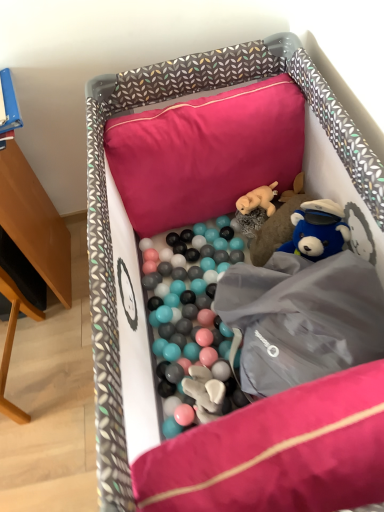
Question: Is fuzzy beige dog at center, acting as the second toy starting from the bottom, closer to the viewer compared to pink fabric pillow at upper center?

Choices:
 (A) no
 (B) yes

Answer: (A)

Question: Considering the relative positions of fuzzy beige dog at center, acting as the second toy starting from the bottom, and pink fabric pillow at upper center in the image provided, is fuzzy beige dog at center, acting as the second toy starting from the bottom, behind pink fabric pillow at upper center?

Choices:
 (A) no
 (B) yes

Answer: (B)

Question: Is fuzzy beige dog at center, acting as the second toy starting from the bottom, turned away from pink fabric pillow at upper center?

Choices:
 (A) no
 (B) yes

Answer: (A)

Question: Does fuzzy beige dog at center, which is counted as the 1th toy, starting from the top, have a greater height compared to pink fabric pillow at upper center?

Choices:
 (A) no
 (B) yes

Answer: (A)

Question: Does fuzzy beige dog at center, which is counted as the 1th toy, starting from the top, appear on the right side of pink fabric pillow at upper center?

Choices:
 (A) no
 (B) yes

Answer: (B)

Question: In the image, is fluffy plush bear at center, acting as the 1th toy starting from the bottom, positioned in front of or behind fuzzy beige dog at center, which is counted as the 1th toy, starting from the top?

Choices:
 (A) behind
 (B) front

Answer: (B)

Question: Is point (297, 202) positioned closer to the camera than point (248, 212)?

Choices:
 (A) farther
 (B) closer

Answer: (B)

Question: Do you think fluffy plush bear at center, which appears as the second toy when viewed from the top, is within fuzzy beige dog at center, acting as the second toy starting from the bottom, or outside of it?

Choices:
 (A) inside
 (B) outside

Answer: (B)

Question: From a real-world perspective, is fluffy plush bear at center, acting as the 1th toy starting from the bottom, physically located above or below fuzzy beige dog at center, acting as the second toy starting from the bottom?

Choices:
 (A) above
 (B) below

Answer: (B)

Question: In terms of height, does fuzzy beige dog at center, which is counted as the 1th toy, starting from the top, look taller or shorter compared to soft fabric playpen at center?

Choices:
 (A) short
 (B) tall

Answer: (A)

Question: From the image's perspective, is fuzzy beige dog at center, which is counted as the 1th toy, starting from the top, above or below soft fabric playpen at center?

Choices:
 (A) below
 (B) above

Answer: (B)

Question: Considering their positions, is fuzzy beige dog at center, which is counted as the 1th toy, starting from the top, located in front of or behind soft fabric playpen at center?

Choices:
 (A) behind
 (B) front

Answer: (A)

Question: Considering the positions of fuzzy beige dog at center, which is counted as the 1th toy, starting from the top, and soft fabric playpen at center in the image, is fuzzy beige dog at center, which is counted as the 1th toy, starting from the top, wider or thinner than soft fabric playpen at center?

Choices:
 (A) wide
 (B) thin

Answer: (B)

Question: Is fluffy plush bear at center, acting as the 1th toy starting from the bottom, spatially inside soft fabric playpen at center, or outside of it?

Choices:
 (A) outside
 (B) inside

Answer: (B)

Question: Considering the positions of fluffy plush bear at center, which appears as the second toy when viewed from the top, and soft fabric playpen at center in the image, is fluffy plush bear at center, which appears as the second toy when viewed from the top, taller or shorter than soft fabric playpen at center?

Choices:
 (A) tall
 (B) short

Answer: (B)